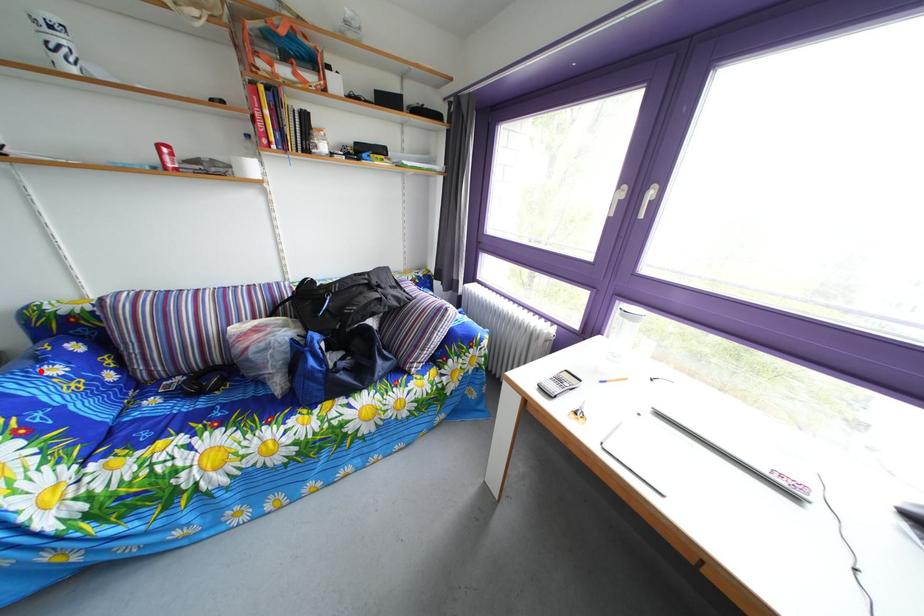
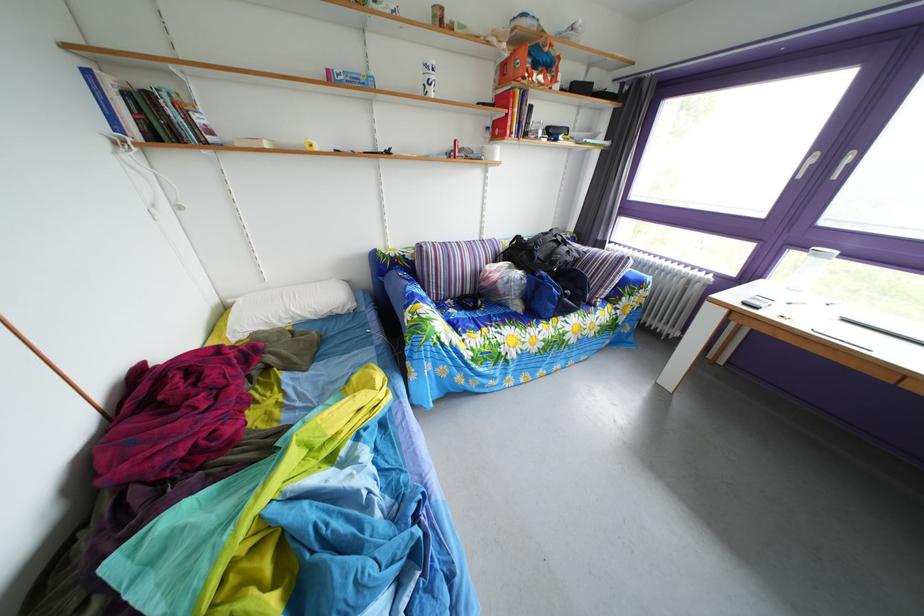
Locate, in the second image, the point that corresponds to the highlighted location in the first image.

(417, 290)